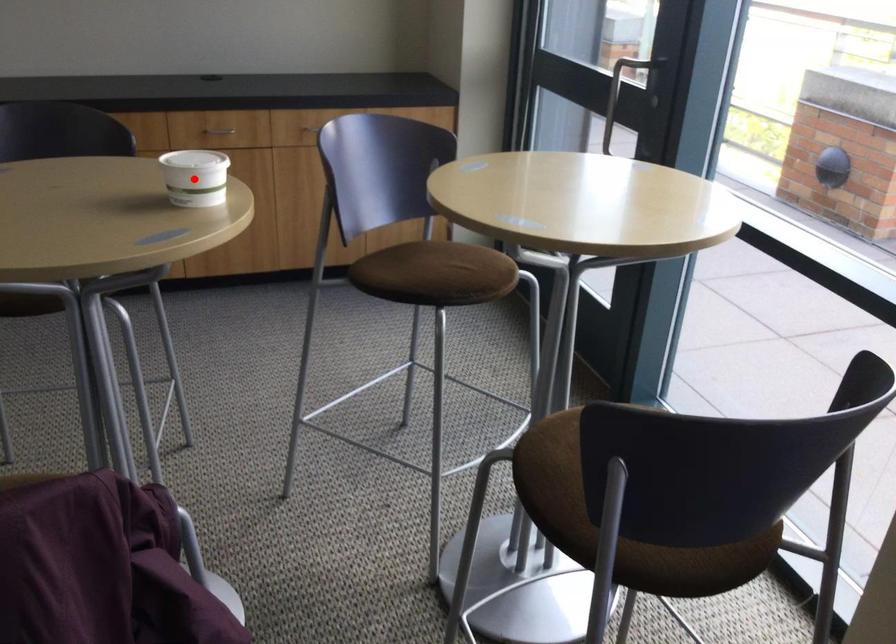
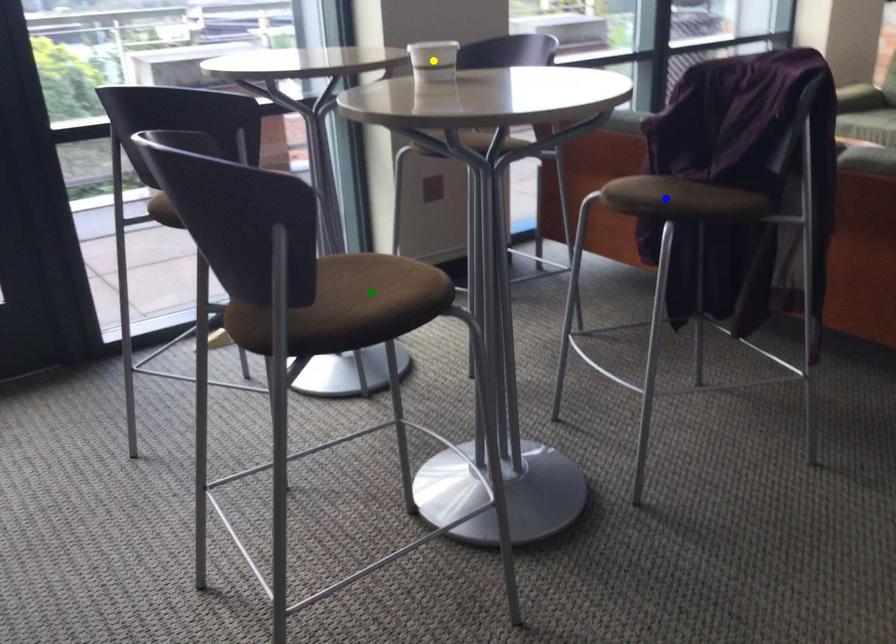
Question: I am providing you with two images of the same scene from different viewpoints. A red point is marked on the first image. You are given multiple points on the second image. Which point in image 2 is actually the same real-world point as the red point in image 1?

Choices:
 (A) blue point
 (B) yellow point
 (C) green point

Answer: (B)